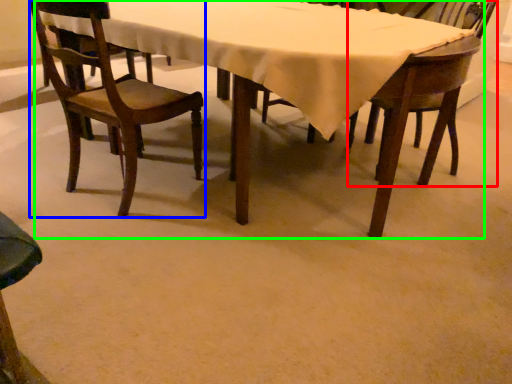
Question: Which object is the farthest from chair (highlighted by a red box)? Choose among these: chair (highlighted by a blue box) or kitchen & dining room table (highlighted by a green box).

Choices:
 (A) chair
 (B) kitchen & dining room table

Answer: (A)